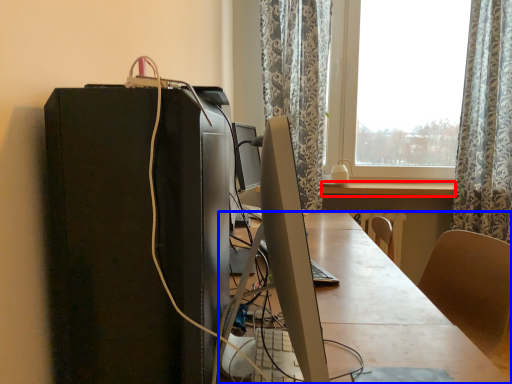
Question: Among these objects, which one is nearest to the camera, table (highlighted by a red box) or desk (highlighted by a blue box)?

Choices:
 (A) table
 (B) desk

Answer: (B)